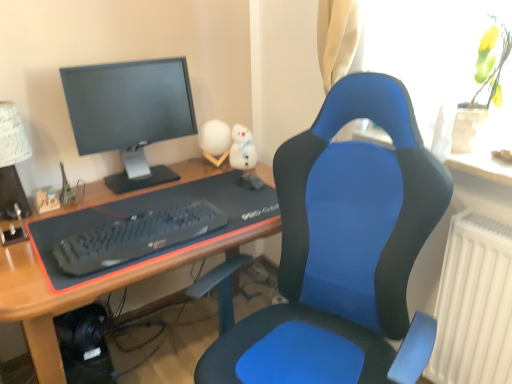
Question: Is blue fabric desk at center in front of or behind black matte keyboard at center in the image?

Choices:
 (A) behind
 (B) front

Answer: (B)

Question: From the image's perspective, is blue fabric desk at center located above or below black matte keyboard at center?

Choices:
 (A) below
 (B) above

Answer: (A)

Question: Based on their relative distances, which object is nearer to the matte black monitor at upper left?

Choices:
 (A) blue fabric desk at center
 (B) white paper lampshade at upper left
 (C) blue fabric chair at center
 (D) transparent glass vase at upper right
 (E) black matte keyboard at center

Answer: (A)

Question: Which object is the farthest from the blue fabric desk at center?

Choices:
 (A) blue fabric chair at center
 (B) black matte keyboard at center
 (C) transparent glass vase at upper right
 (D) white paper lampshade at upper left
 (E) matte black monitor at upper left

Answer: (C)